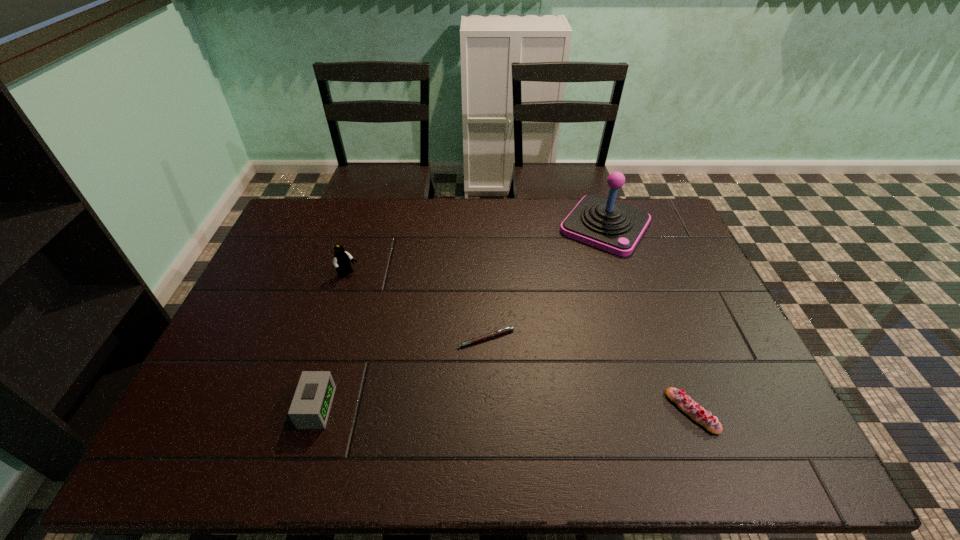
What are the coordinates of `vacant space on the desktop that is between the alarm clock and the second shortest object and is positioned at the nib of the third object from left to right` in the screenshot? It's located at (470, 409).

Find the location of a particular element. The image size is (960, 540). free space on the desktop that is between the third tallest object and the fourth tallest object and is positioned forward from the base of the joystick is located at coordinates (474, 409).

Identify the location of vacant space on the desktop that is between the alarm clock and the eclair and is positioned on the front-facing side of the second tallest object. Image resolution: width=960 pixels, height=540 pixels. (516, 410).